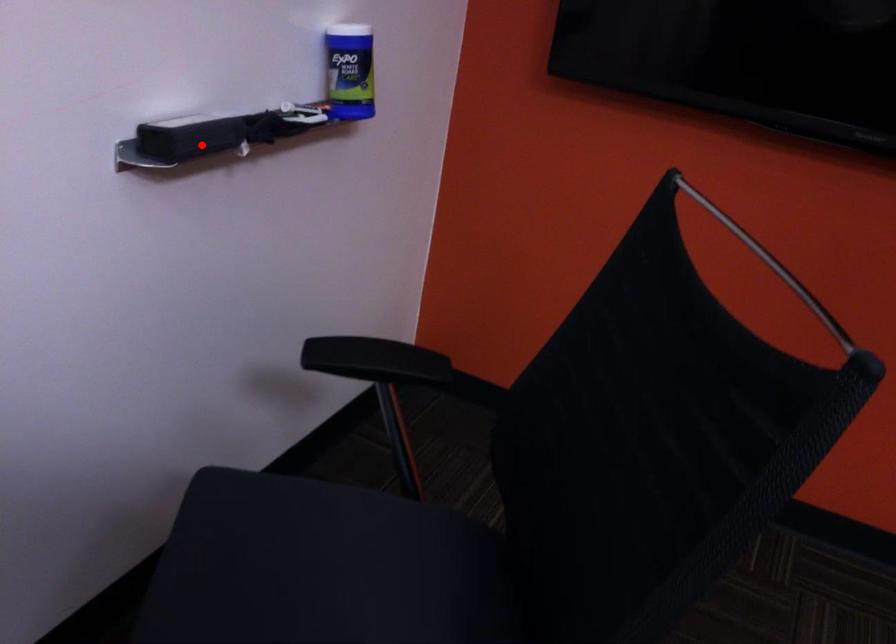
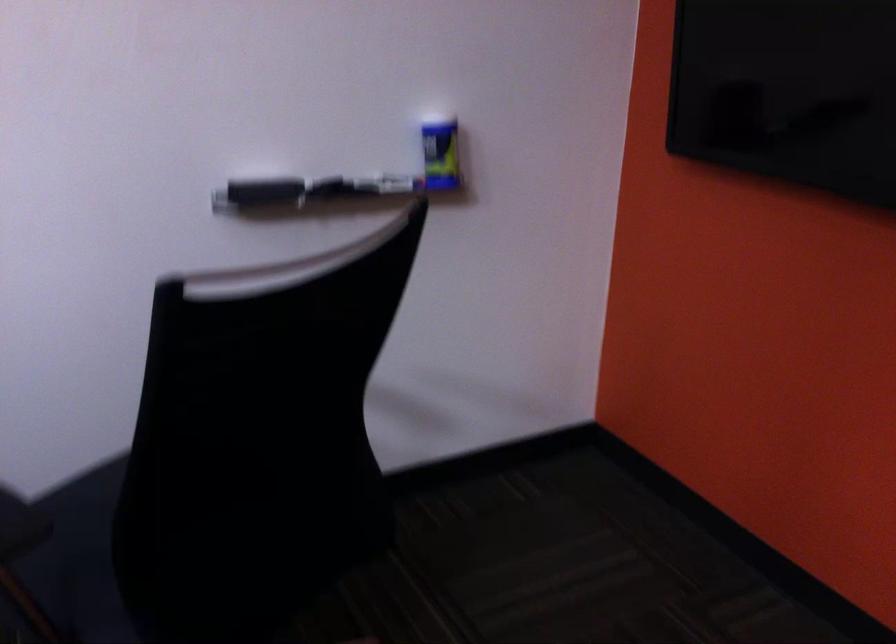
Locate, in the second image, the point that corresponds to the highlighted location in the first image.

(261, 191)